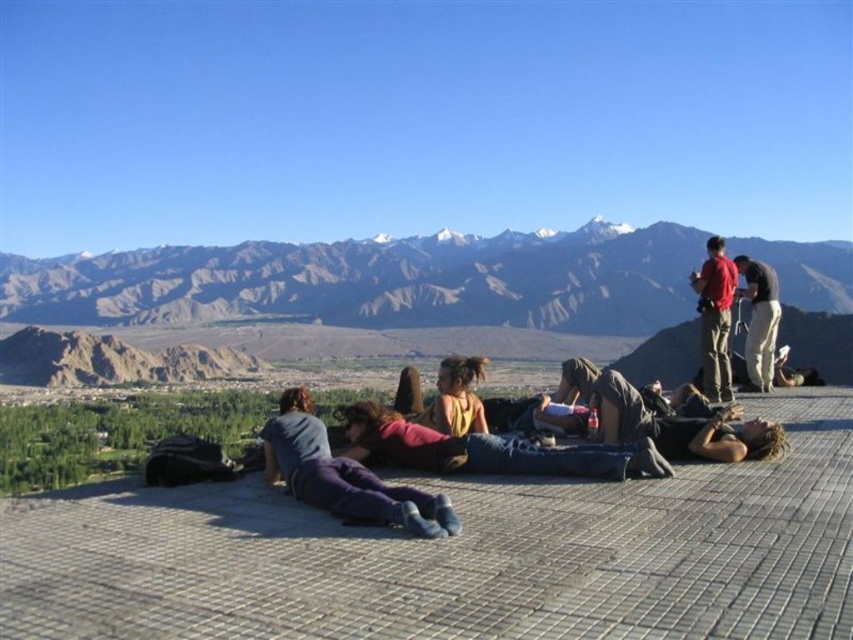
From the picture: You are standing on the tiled platform and want to move from the purple cotton pants at center to the dark gray pants at right. Can you walk directly between them without stepping on any other objects?

The purple cotton pants at center is positioned under dark gray pants at right, meaning they are stacked vertically. Since they are not on the same horizontal plane, you cannot walk directly between them without stepping on the purple cotton pants at center.

You are a photographer standing at the edge of the platform. You want to take a photo that includes both the purple cotton pants at center and the dark gray pants at right without any obstructions. Given that your camera has a maximum zoom range that can capture objects up to 50 meters apart, will you need to adjust your position to ensure both subjects are in frame?

The distance between the purple cotton pants at center and dark gray pants at right is 57.09 meters, which exceeds the camera maximum zoom range of 50 meters. Therefore, you will need to move closer to the subjects to reduce the distance between them within the camera range.

You are a photographer trying to capture a candid shot of the two people at the center of the scene. You notice the denim jeans at center and dark brown hair at center. Which object would you focus on first if you want to ensure both are in frame without cropping?

The denim jeans at center has a larger width than the dark brown hair at center, so focusing on the denim jeans at center first would ensure both objects are within the frame since it occupies more space.